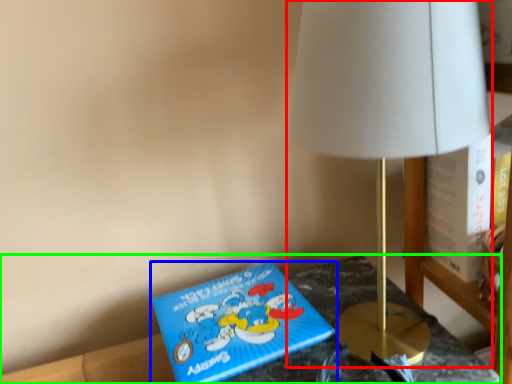
Question: Which object is positioned closest to lamp (highlighted by a red box)? Select from book (highlighted by a blue box) and furniture (highlighted by a green box).

Choices:
 (A) book
 (B) furniture

Answer: (B)